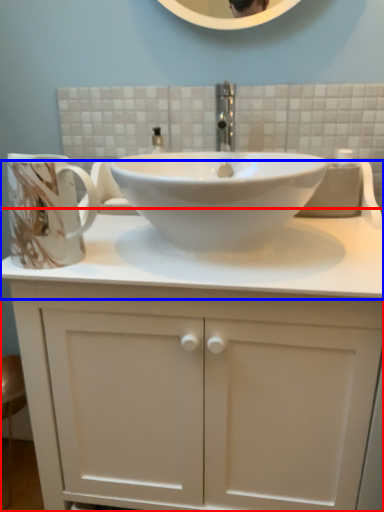
Question: Which object is closer to the camera taking this photo, bathroom cabinet (highlighted by a red box) or counter top (highlighted by a blue box)?

Choices:
 (A) bathroom cabinet
 (B) counter top

Answer: (A)